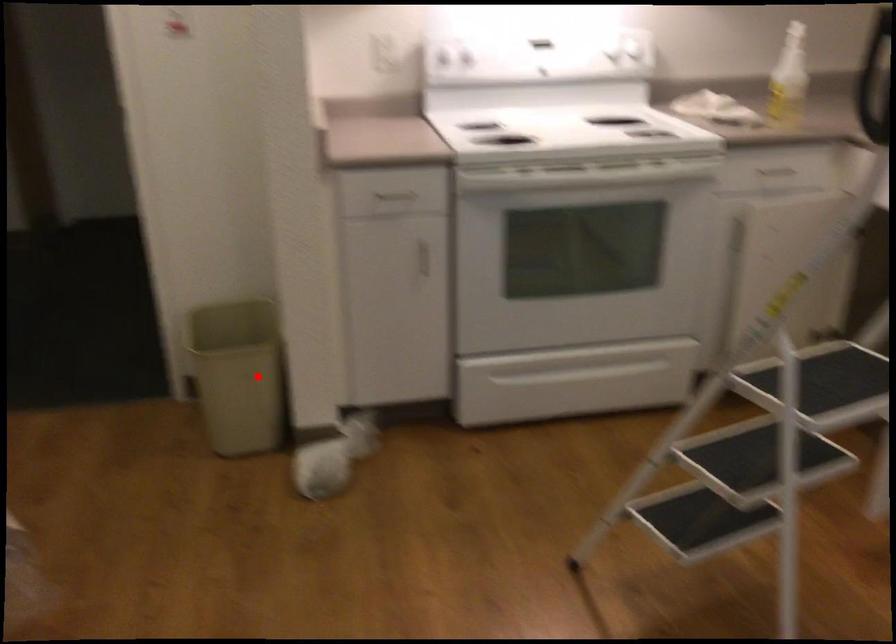
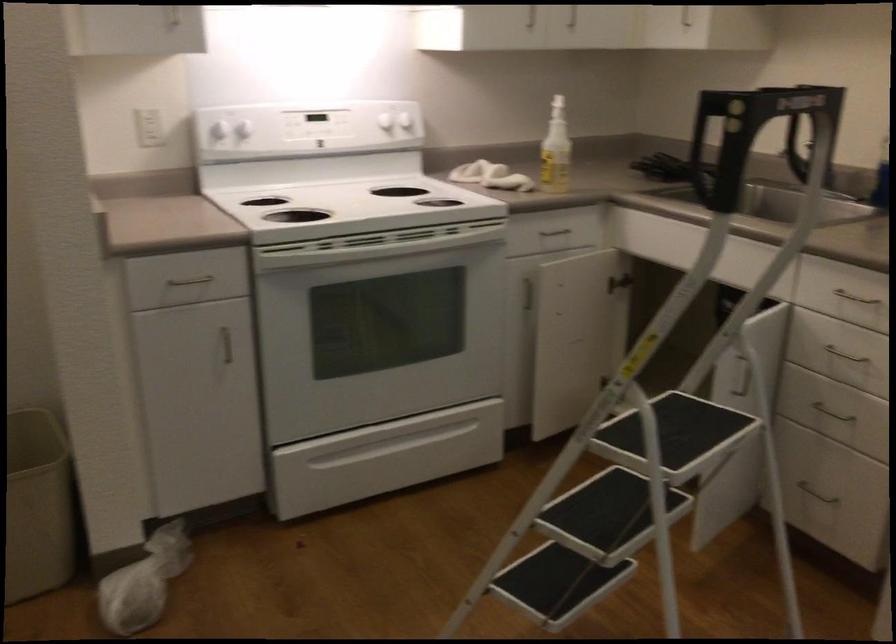
Question: I am providing you with two images of the same scene from different viewpoints. Given a red point in image1, look at the same physical point in image2. Is it:

Choices:
 (A) Closer to the viewpoint
 (B) Farther from the viewpoint

Answer: (A)